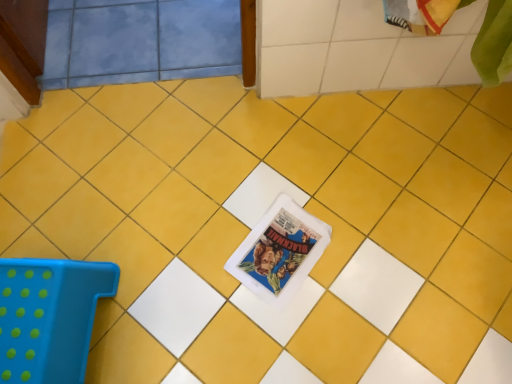
I want to click on free space that is in between blue plastic stool at lower left and matte plastic comic book at center, so click(x=183, y=282).